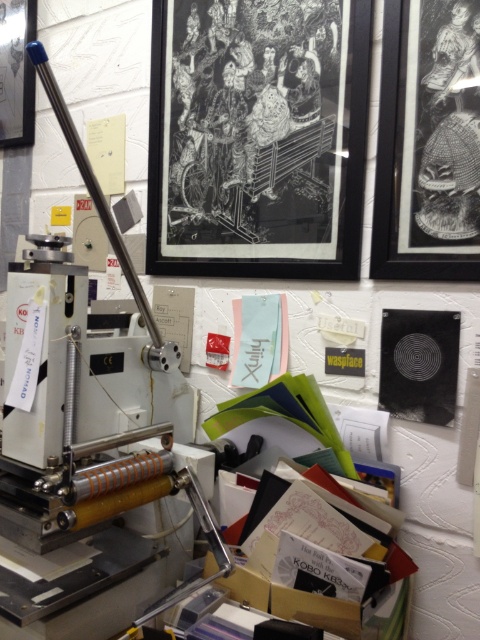
Question: Is black matte picture frame at upper center closer to the viewer compared to black matte picture frame at upper right?

Choices:
 (A) no
 (B) yes

Answer: (A)

Question: Observing the image, what is the correct spatial positioning of black matte picture frame at upper center in reference to black matte picture frame at upper right?

Choices:
 (A) left
 (B) right

Answer: (A)

Question: Which object appears farthest from the camera in this image?

Choices:
 (A) matte black picture frame at upper left
 (B) black matte picture frame at upper right
 (C) black matte picture frame at upper center

Answer: (A)

Question: Estimate the real-world distances between objects in this image. Which object is farther from the black matte picture frame at upper right?

Choices:
 (A) black matte picture frame at upper center
 (B) matte black picture frame at upper left

Answer: (B)

Question: Where is black matte picture frame at upper center located in relation to black matte picture frame at upper right in the image?

Choices:
 (A) left
 (B) right

Answer: (A)

Question: Which of the following is the farthest from the observer?

Choices:
 (A) (x=432, y=65)
 (B) (x=309, y=189)

Answer: (B)